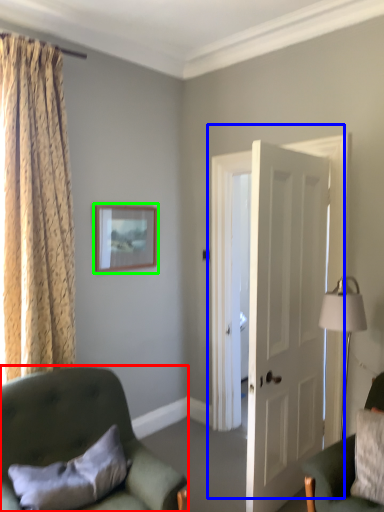
Question: Considering the real-world distances, which object is farthest from chair (highlighted by a red box)? door (highlighted by a blue box) or picture frame (highlighted by a green box)?

Choices:
 (A) door
 (B) picture frame

Answer: (A)